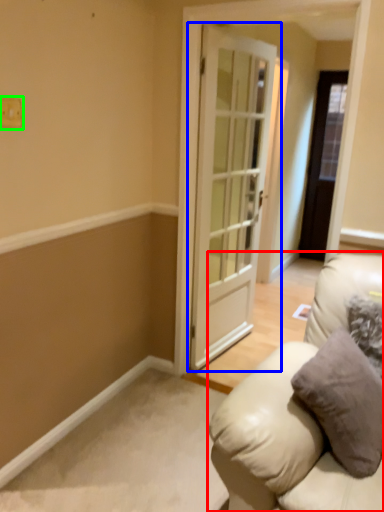
Question: Which object is positioned closest to studio couch (highlighted by a red box)? Select from door (highlighted by a blue box) and light switch (highlighted by a green box).

Choices:
 (A) door
 (B) light switch

Answer: (A)